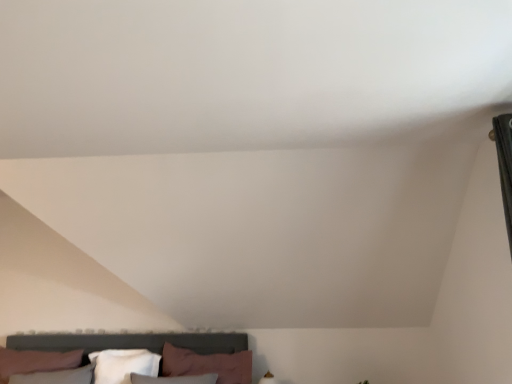
Question: Does pink fabric pillow at lower center, positioned as the second pillow in left-to-right order, appear on the left side of white soft pillow at lower center, the second pillow in the right-to-left sequence?

Choices:
 (A) yes
 (B) no

Answer: (B)

Question: Is pink fabric pillow at lower center, which appears as the first pillow when viewed from the right, turned away from white soft pillow at lower center, the first pillow viewed from the left?

Choices:
 (A) yes
 (B) no

Answer: (B)

Question: Is the surface of pink fabric pillow at lower center, positioned as the second pillow in left-to-right order, in direct contact with white soft pillow at lower center, the first pillow viewed from the left?

Choices:
 (A) no
 (B) yes

Answer: (A)

Question: Is pink fabric pillow at lower center, positioned as the second pillow in left-to-right order, thinner than white soft pillow at lower center, the first pillow viewed from the left?

Choices:
 (A) no
 (B) yes

Answer: (A)

Question: Is pink fabric pillow at lower center, which appears as the first pillow when viewed from the right, wider than white soft pillow at lower center, the first pillow viewed from the left?

Choices:
 (A) yes
 (B) no

Answer: (A)

Question: Is pink fabric pillow at lower center, which appears as the first pillow when viewed from the right, further to the viewer compared to white soft pillow at lower center, the first pillow viewed from the left?

Choices:
 (A) no
 (B) yes

Answer: (A)

Question: From the image's perspective, does white soft pillow at lower center, the first pillow viewed from the left, appear lower than pink fabric pillow at lower center, which appears as the first pillow when viewed from the right?

Choices:
 (A) yes
 (B) no

Answer: (A)

Question: Does white soft pillow at lower center, the first pillow viewed from the left, have a greater height compared to pink fabric pillow at lower center, positioned as the second pillow in left-to-right order?

Choices:
 (A) yes
 (B) no

Answer: (B)

Question: Can you see white soft pillow at lower center, the first pillow viewed from the left, touching pink fabric pillow at lower center, which appears as the first pillow when viewed from the right?

Choices:
 (A) no
 (B) yes

Answer: (A)

Question: Is white soft pillow at lower center, the second pillow in the right-to-left sequence, thinner than pink fabric pillow at lower center, which appears as the first pillow when viewed from the right?

Choices:
 (A) yes
 (B) no

Answer: (A)

Question: Is white soft pillow at lower center, the second pillow in the right-to-left sequence, positioned behind pink fabric pillow at lower center, which appears as the first pillow when viewed from the right?

Choices:
 (A) no
 (B) yes

Answer: (B)

Question: From the image's perspective, is white soft pillow at lower center, the second pillow in the right-to-left sequence, above pink fabric pillow at lower center, which appears as the first pillow when viewed from the right?

Choices:
 (A) no
 (B) yes

Answer: (A)

Question: From a real-world perspective, is white soft pillow at lower center, the second pillow in the right-to-left sequence, above or below pink fabric pillow at lower center, which appears as the first pillow when viewed from the right?

Choices:
 (A) above
 (B) below

Answer: (B)